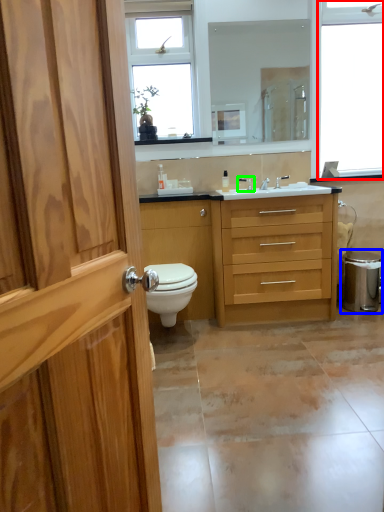
Question: Estimate the real-world distances between objects in this image. Which object is closer to window (highlighted by a red box), water heater (highlighted by a blue box) or tap (highlighted by a green box)?

Choices:
 (A) water heater
 (B) tap

Answer: (B)